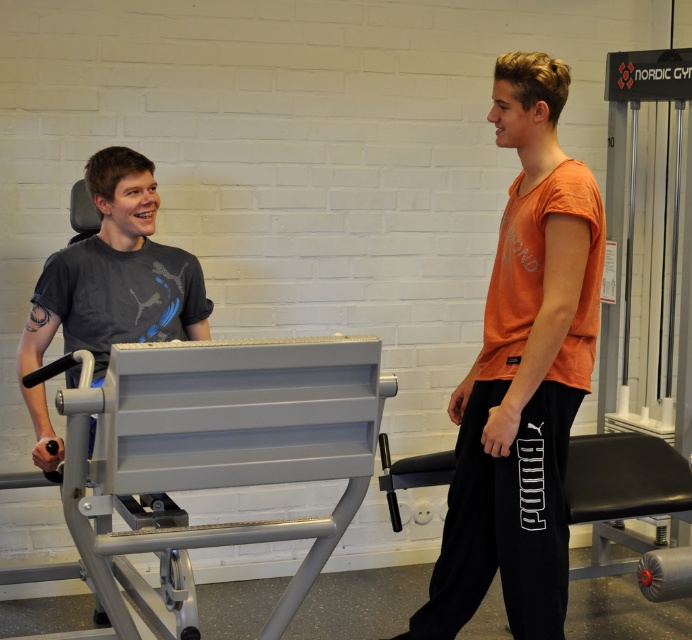
Question: Does orange cotton t-shirt at right have a greater width compared to matte black t-shirt at left?

Choices:
 (A) no
 (B) yes

Answer: (B)

Question: Among these objects, which one is nearest to the camera?

Choices:
 (A) orange cotton t-shirt at right
 (B) matte black t-shirt at left

Answer: (B)

Question: Can you confirm if orange cotton t-shirt at right is positioned above matte black t-shirt at left?

Choices:
 (A) yes
 (B) no

Answer: (B)

Question: Among these objects, which one is farthest from the camera?

Choices:
 (A) orange cotton t-shirt at right
 (B) matte black t-shirt at left

Answer: (A)

Question: Is orange cotton t-shirt at right to the right of matte black t-shirt at left from the viewer's perspective?

Choices:
 (A) yes
 (B) no

Answer: (A)